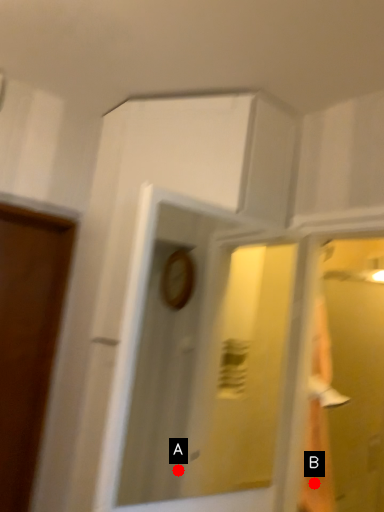
Question: Two points are circled on the image, labeled by A and B beside each circle. Which point appears closest to the camera in this image?

Choices:
 (A) A is closer
 (B) B is closer

Answer: (B)